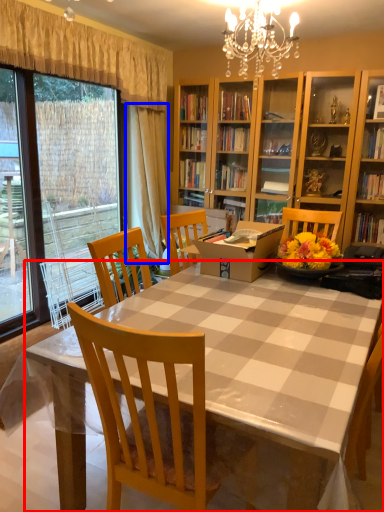
Question: Which object appears farthest to the camera in this image, desk (highlighted by a red box) or curtain (highlighted by a blue box)?

Choices:
 (A) desk
 (B) curtain

Answer: (B)